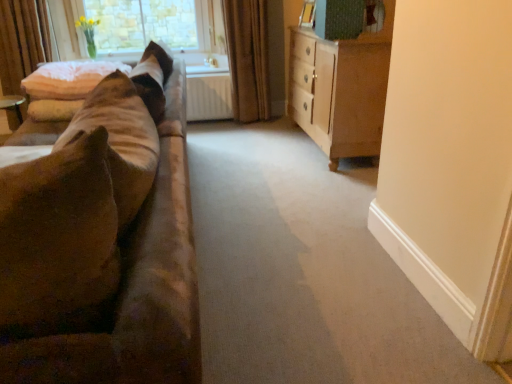
Identify the location of free space in front of brown textured curtain at center. Image resolution: width=512 pixels, height=384 pixels. (243, 130).